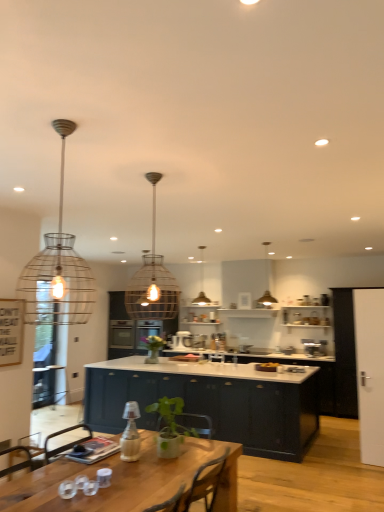
The width and height of the screenshot is (384, 512). What are the coordinates of `vacant area on top of wooden table at lower left (from a real-world perspective)` in the screenshot? It's located at (110, 473).